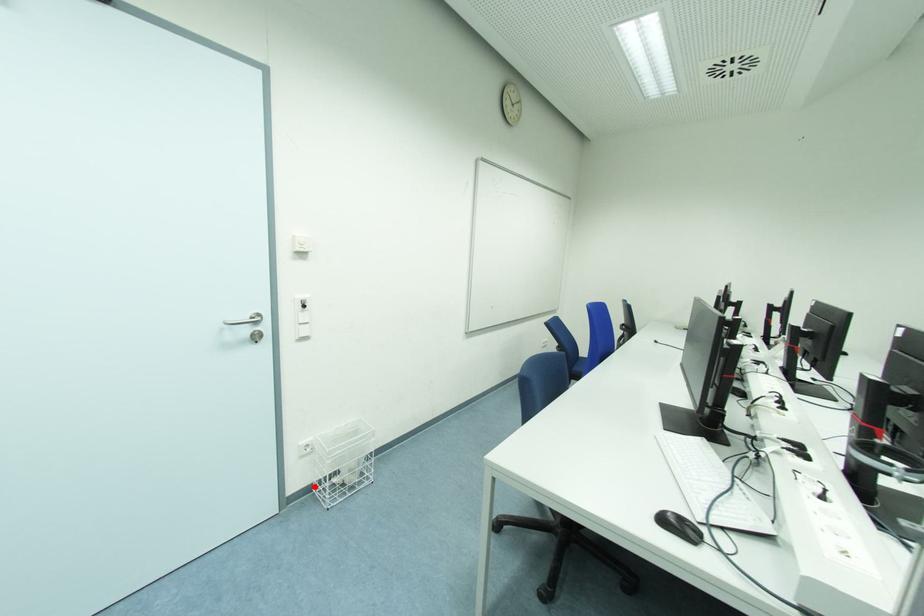
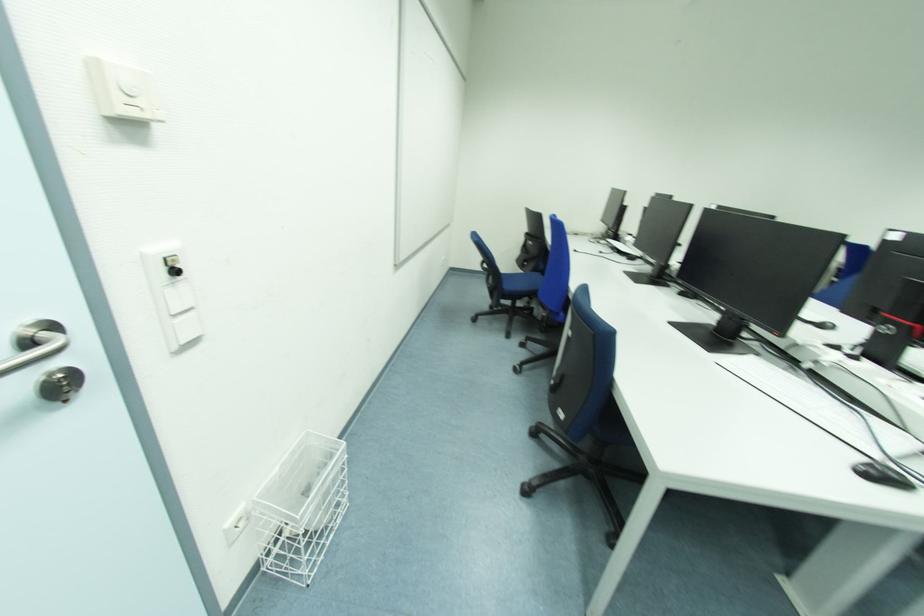
Find the pixel in the second image that matches the highlighted location in the first image.

(261, 564)